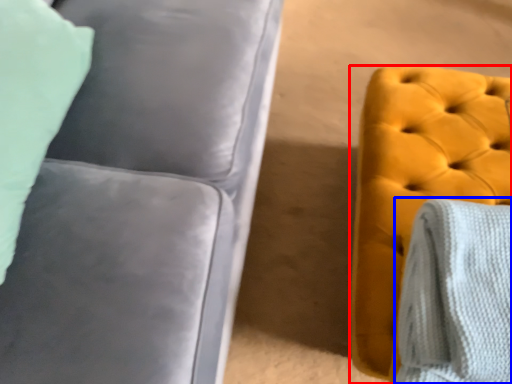
Question: Which object is further to the camera taking this photo, furniture (highlighted by a red box) or blanket (highlighted by a blue box)?

Choices:
 (A) furniture
 (B) blanket

Answer: (A)